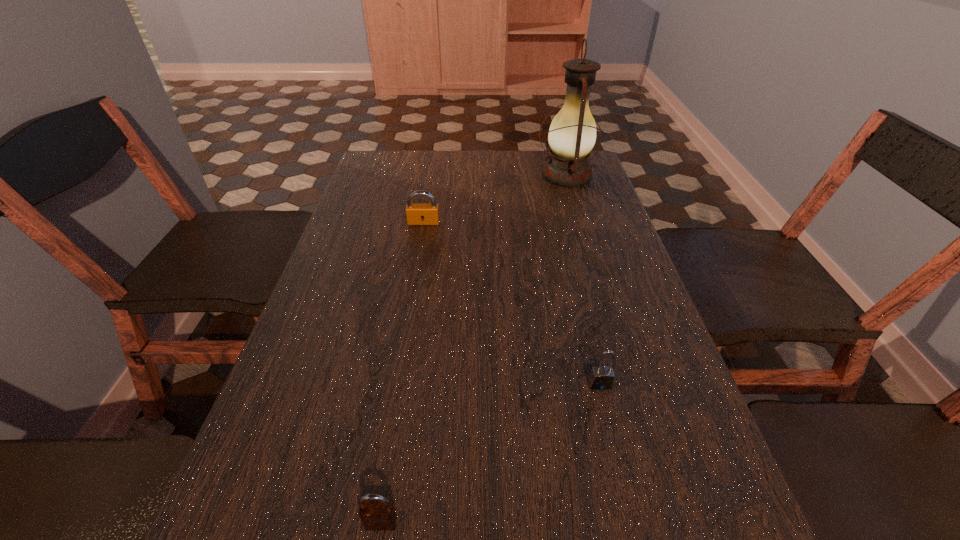
This screenshot has width=960, height=540. Find the location of `free space between the rightmost padlock and the nearest object`. free space between the rightmost padlock and the nearest object is located at coordinates (491, 454).

Locate an element on the screen. The image size is (960, 540). free space between the nearest object and the rightmost padlock is located at coordinates (491, 454).

Find the location of a particular element. Image resolution: width=960 pixels, height=540 pixels. unoccupied area between the farthest object and the nearest padlock is located at coordinates (473, 349).

Where is `vacant space in between the nearest padlock and the farthest object`? The height and width of the screenshot is (540, 960). vacant space in between the nearest padlock and the farthest object is located at coordinates (473, 349).

Image resolution: width=960 pixels, height=540 pixels. What are the coordinates of `free space between the oil lamp and the nearest padlock` in the screenshot? It's located at (473, 349).

Locate an element on the screen. free space between the farthest object and the nearest object is located at coordinates (473, 349).

The image size is (960, 540). What are the coordinates of `vacant area between the second farthest padlock and the nearest object` in the screenshot? It's located at (491, 454).

Choose which object is the nearest neighbor to the farthest object. Please provide its 2D coordinates. Your answer should be formatted as a tuple, i.e. [(x, y)], where the tuple contains the x and y coordinates of a point satisfying the conditions above.

[(416, 214)]

The width and height of the screenshot is (960, 540). Identify the location of object that stands as the closest to the farthest padlock. (572, 134).

At what (x,y) coordinates should I click in order to perform the action: click on padlock that can be found as the second closest to the tallest object. Please return your answer as a coordinate pair (x, y). The image size is (960, 540). Looking at the image, I should click on (602, 377).